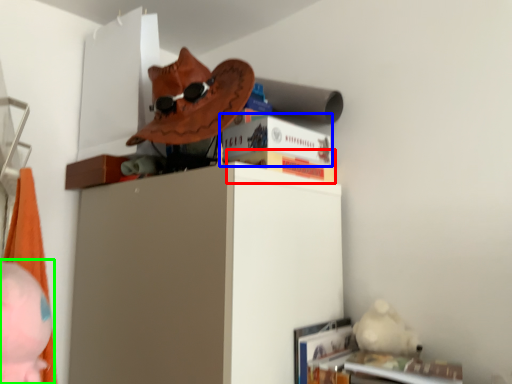
Question: Estimate the real-world distances between objects in this image. Which object is closer to paperback book (highlighted by a red box), paperback book (highlighted by a blue box) or person (highlighted by a green box)?

Choices:
 (A) paperback book
 (B) person

Answer: (A)